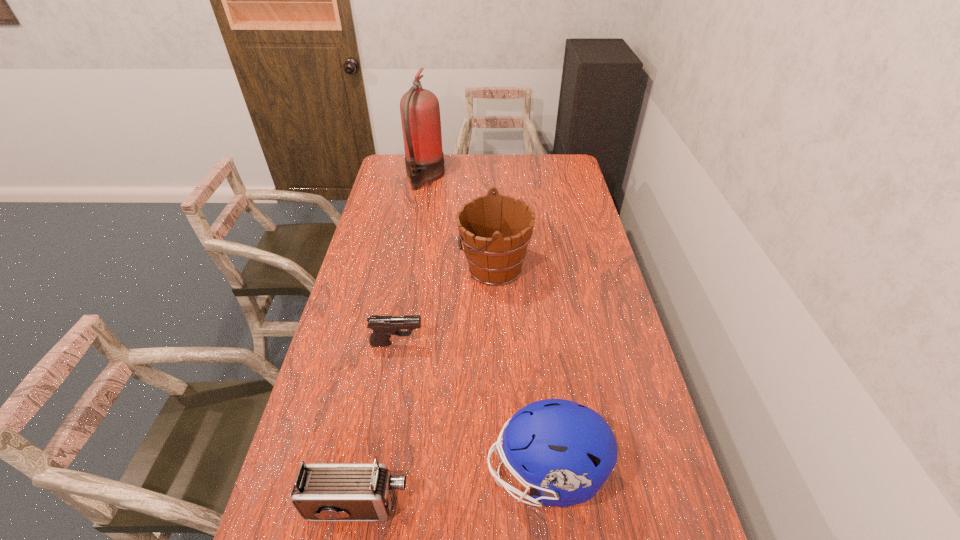
You are a GUI agent. You are given a task and a screenshot of the screen. Output one action in this format:
    pyautogui.click(x=<x>, y=<y>)
    Task: Click on the vacant space that is in between the camcorder and the third nearest object
    This screenshot has width=960, height=540.
    Given the screenshot: What is the action you would take?
    pyautogui.click(x=377, y=424)

This screenshot has width=960, height=540. Find the location of `empty location between the fire extinguisher and the camcorder`. empty location between the fire extinguisher and the camcorder is located at coordinates (392, 341).

Find the location of a particular element. The image size is (960, 540). vacant area that lies between the football helmet and the farthest object is located at coordinates (485, 325).

Identify the location of free space between the camcorder and the fire extinguisher. The width and height of the screenshot is (960, 540). (392, 341).

Find the location of `free area in between the second shortest object and the fourth nearest object`. free area in between the second shortest object and the fourth nearest object is located at coordinates (426, 386).

Locate an element on the screen. The height and width of the screenshot is (540, 960). empty location between the football helmet and the wine bucket is located at coordinates (519, 370).

The image size is (960, 540). I want to click on object that is the fourth nearest to the tallest object, so click(322, 491).

The width and height of the screenshot is (960, 540). What are the coordinates of `object that is the third closest to the farthest object` in the screenshot? It's located at (566, 451).